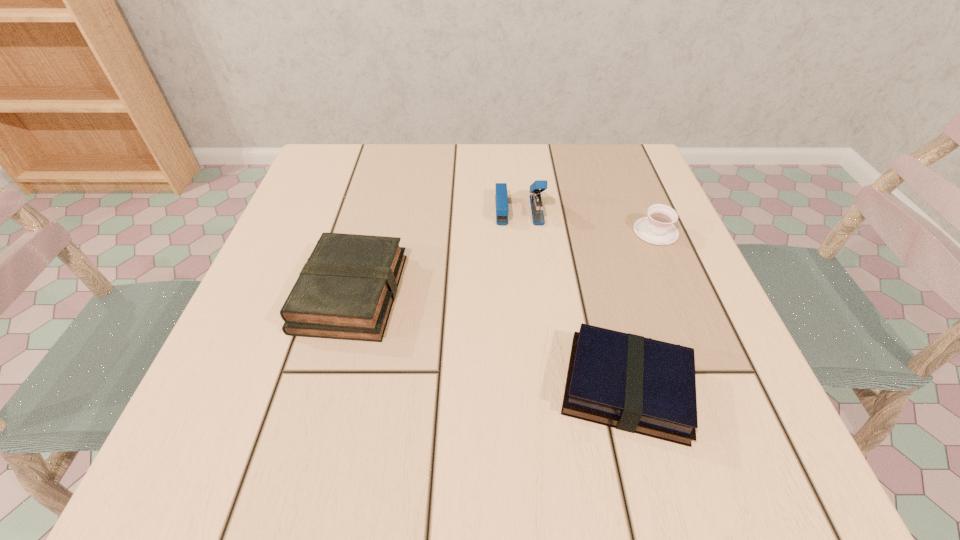
The width and height of the screenshot is (960, 540). In order to click on blank region between the teacup and the shorter book in this screenshot , I will do `click(641, 309)`.

Locate which object ranks third in proximity to the left book. Please provide its 2D coordinates. Your answer should be formatted as a tuple, i.e. [(x, y)], where the tuple contains the x and y coordinates of a point satisfying the conditions above.

[(658, 228)]

Where is `object identified as the second closest to the right book`? The image size is (960, 540). object identified as the second closest to the right book is located at coordinates (346, 289).

Locate an element on the screen. free location that satisfies the following two spatial constraints: 1. on the front side of the left book; 2. on the left side of the right book is located at coordinates (325, 387).